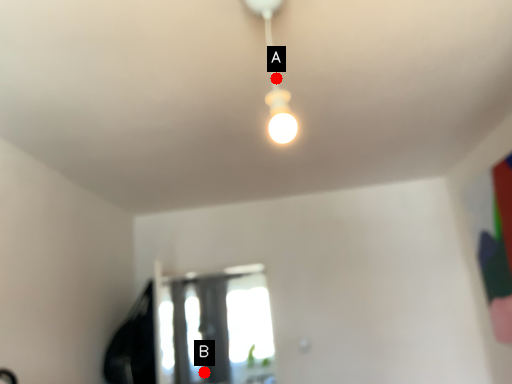
Question: Two points are circled on the image, labeled by A and B beside each circle. Which point appears closest to the camera in this image?

Choices:
 (A) A is closer
 (B) B is closer

Answer: (A)